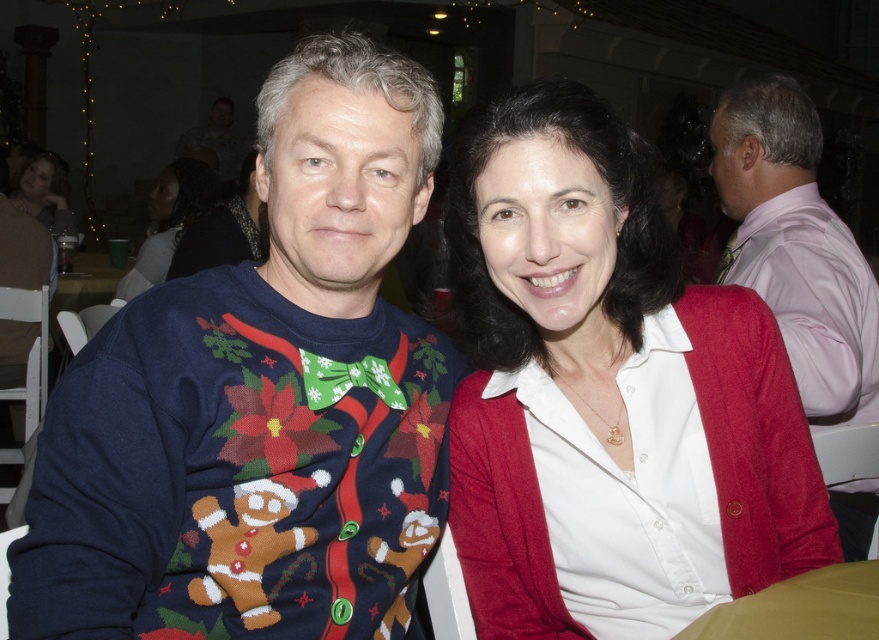
Can you confirm if white matte shirt at center is shorter than pink satin shirt at right?

Correct, white matte shirt at center is not as tall as pink satin shirt at right.

Between white matte shirt at center and pink satin shirt at right, which one appears on the right side from the viewer's perspective?

Positioned to the right is pink satin shirt at right.

Is point (514, 172) positioned after point (763, 170)?

No, (514, 172) is in front of (763, 170).

Find the location of a particular element. white matte shirt at center is located at coordinates (608, 387).

Which of these two, knitted sweater at center or white matte shirt at center, stands taller?

Standing taller between the two is knitted sweater at center.

The image size is (879, 640). In order to click on knitted sweater at center in this screenshot , I will do `click(260, 401)`.

This screenshot has width=879, height=640. What do you see at coordinates (260, 401) in the screenshot?
I see `knitted sweater at center` at bounding box center [260, 401].

I want to click on knitted sweater at center, so click(x=260, y=401).

Which of these two, knitted sweater at center or dark brown hair at upper left, stands taller?

A: knitted sweater at center is taller.

Between point (178, 352) and point (115, 285), which one is positioned behind?

The point (115, 285) is behind.

This screenshot has width=879, height=640. Identify the location of knitted sweater at center. (260, 401).